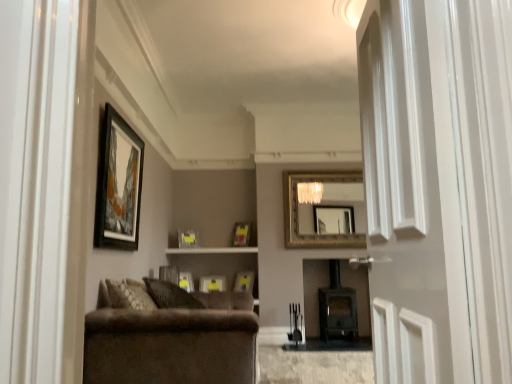
Question: Which direction should I rotate to look at matte yellow picture frame at center, which ranks as the 6th picture frame in front-to-back order, — up or down?

Choices:
 (A) down
 (B) up

Answer: (A)

Question: From the image's perspective, is velvet brown couch at lower left located above wooden picture frame at upper left, acting as the 7th picture frame starting from the back?

Choices:
 (A) yes
 (B) no

Answer: (B)

Question: Considering the relative sizes of velvet brown couch at lower left and wooden picture frame at upper left, placed as the first picture frame when sorted from front to back, in the image provided, is velvet brown couch at lower left taller than wooden picture frame at upper left, placed as the first picture frame when sorted from front to back,?

Choices:
 (A) yes
 (B) no

Answer: (B)

Question: Can you see velvet brown couch at lower left touching wooden picture frame at upper left, placed as the first picture frame when sorted from front to back?

Choices:
 (A) no
 (B) yes

Answer: (A)

Question: From the image's perspective, is velvet brown couch at lower left beneath wooden picture frame at upper left, placed as the first picture frame when sorted from front to back?

Choices:
 (A) yes
 (B) no

Answer: (A)

Question: Would you say velvet brown couch at lower left contains wooden picture frame at upper left, placed as the first picture frame when sorted from front to back?

Choices:
 (A) yes
 (B) no

Answer: (B)

Question: Is velvet brown couch at lower left further to the viewer compared to wooden picture frame at upper left, acting as the 7th picture frame starting from the back?

Choices:
 (A) yes
 (B) no

Answer: (B)

Question: Considering the relative positions of matte yellow picture frame at center, positioned as the first picture frame in back-to-front order, and matte yellow picture frame at center, which is counted as the 2th picture frame, starting from the back, in the image provided, is matte yellow picture frame at center, positioned as the first picture frame in back-to-front order, in front of matte yellow picture frame at center, which is counted as the 2th picture frame, starting from the back,?

Choices:
 (A) no
 (B) yes

Answer: (A)

Question: Is matte yellow picture frame at center, placed as the seventh picture frame when sorted from front to back, bigger than matte yellow picture frame at center, which ranks as the 6th picture frame in front-to-back order?

Choices:
 (A) yes
 (B) no

Answer: (A)

Question: Could you tell me if matte yellow picture frame at center, positioned as the first picture frame in back-to-front order, is facing matte yellow picture frame at center, which ranks as the 6th picture frame in front-to-back order?

Choices:
 (A) no
 (B) yes

Answer: (A)

Question: From a real-world perspective, is matte yellow picture frame at center, placed as the seventh picture frame when sorted from front to back, beneath matte yellow picture frame at center, which ranks as the 6th picture frame in front-to-back order?

Choices:
 (A) no
 (B) yes

Answer: (B)

Question: Does matte yellow picture frame at center, placed as the seventh picture frame when sorted from front to back, have a lesser width compared to matte yellow picture frame at center, which is counted as the 2th picture frame, starting from the back?

Choices:
 (A) no
 (B) yes

Answer: (A)

Question: From the image's perspective, does matte yellow picture frame at center, positioned as the first picture frame in back-to-front order, appear lower than matte yellow picture frame at center, which ranks as the 6th picture frame in front-to-back order?

Choices:
 (A) yes
 (B) no

Answer: (A)

Question: From the image's perspective, would you say matte wood shelf at center is shown under matte black picture frame at center, placed as the second picture frame when sorted from front to back?

Choices:
 (A) no
 (B) yes

Answer: (A)